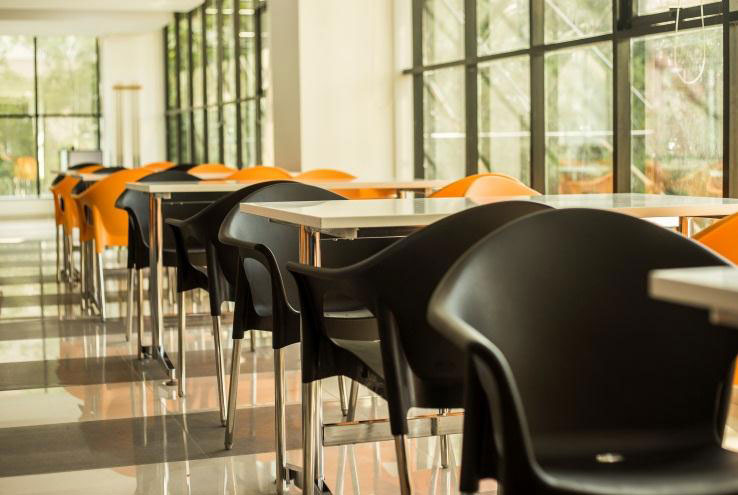
What are the coordinates of `yellow chairs` in the screenshot? It's located at (488, 188), (714, 233), (327, 172), (249, 175), (106, 185), (209, 166), (162, 163), (89, 167).